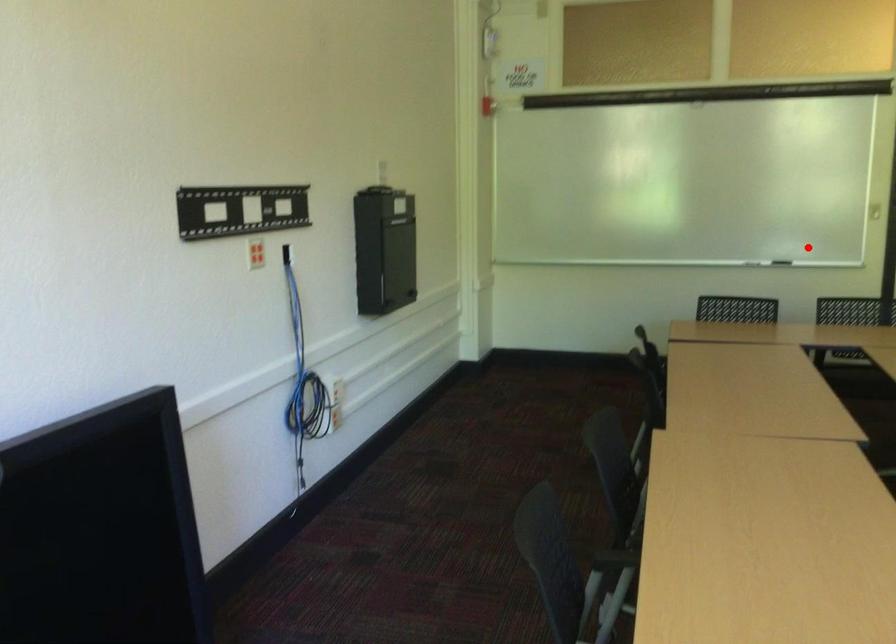
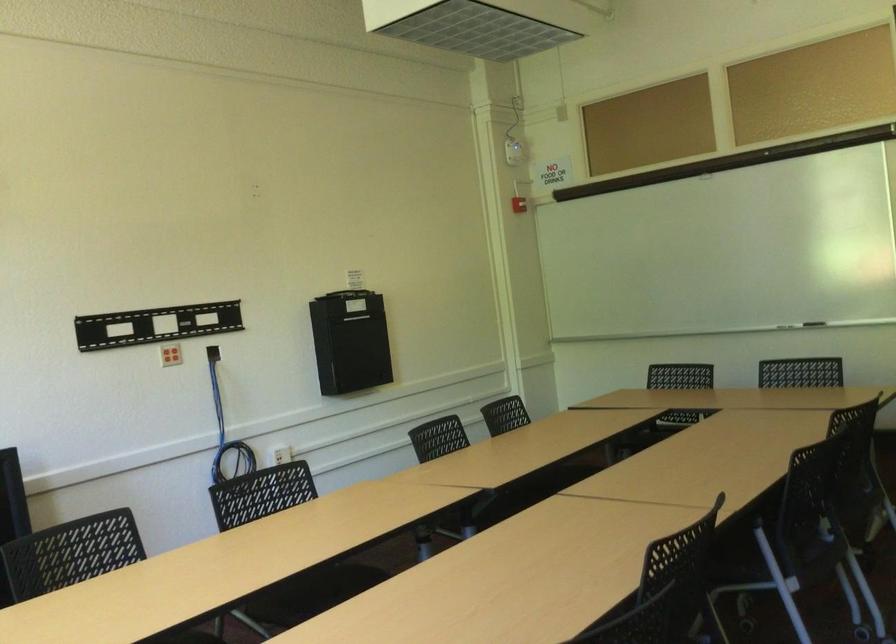
The point at the highlighted location is marked in the first image. Where is the corresponding point in the second image?

(814, 323)